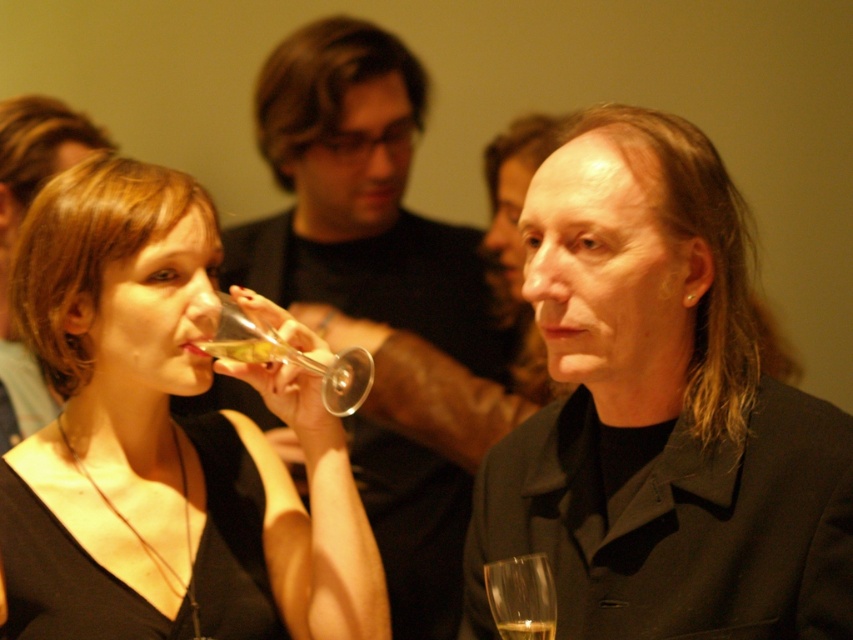
Can you confirm if matte black shirt at center is positioned below clear glass wine glass at lower center?

No, matte black shirt at center is not below clear glass wine glass at lower center.

The image size is (853, 640). Find the location of `matte black shirt at center`. matte black shirt at center is located at coordinates (376, 291).

Between matte black dress at center and translucent glass wine glass at upper center, which one has less height?

translucent glass wine glass at upper center is shorter.

Is matte black dress at center closer to camera compared to translucent glass wine glass at upper center?

No, it is behind translucent glass wine glass at upper center.

Identify the location of matte black dress at center. The image size is (853, 640). (163, 442).

Can you confirm if matte black shirt at center is wider than translucent glass at lower right?

Yes.

Is matte black shirt at center to the left of translucent glass at lower right from the viewer's perspective?

Indeed, matte black shirt at center is positioned on the left side of translucent glass at lower right.

The image size is (853, 640). What do you see at coordinates (376, 291) in the screenshot?
I see `matte black shirt at center` at bounding box center [376, 291].

This screenshot has height=640, width=853. I want to click on matte black shirt at center, so click(x=376, y=291).